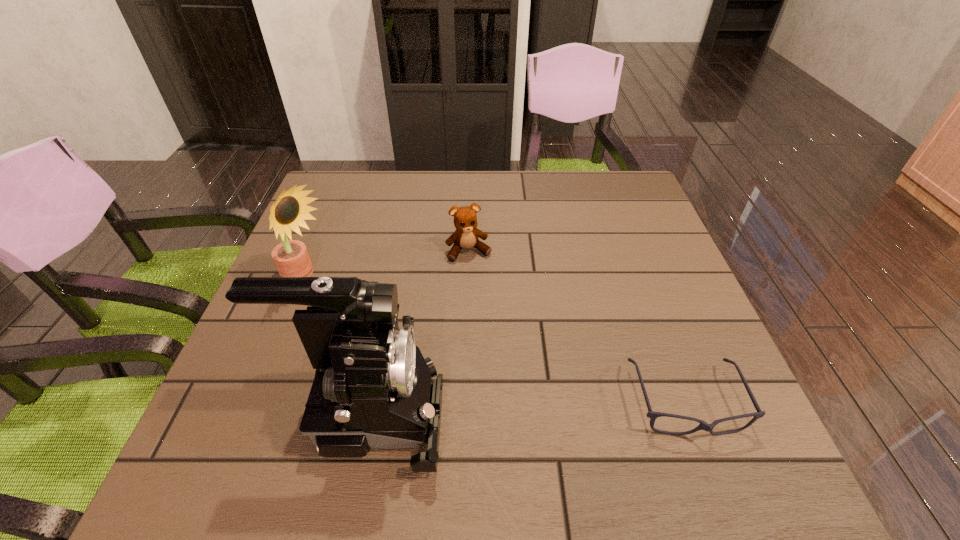
The height and width of the screenshot is (540, 960). Find the location of `camcorder`. camcorder is located at coordinates (372, 388).

At what (x,y) coordinates should I click in order to perform the action: click on the rightmost object. Please return your answer as a coordinate pair (x, y). This screenshot has height=540, width=960. Looking at the image, I should click on (652, 415).

This screenshot has height=540, width=960. Find the location of `the shortest object`. the shortest object is located at coordinates coord(652,415).

At what (x,y) coordinates should I click in order to perform the action: click on sunflower. Please return your answer as a coordinate pair (x, y). Image resolution: width=960 pixels, height=540 pixels. Looking at the image, I should click on (291, 257).

The image size is (960, 540). In order to click on the third shortest object in this screenshot , I will do `click(291, 257)`.

At what (x,y) coordinates should I click in order to perform the action: click on teddy bear. Please return your answer as a coordinate pair (x, y). The height and width of the screenshot is (540, 960). Looking at the image, I should click on (466, 235).

Locate an element on the screen. This screenshot has height=540, width=960. vacant position located 0.210m on the lens mount of the tallest object is located at coordinates (563, 414).

Locate an element on the screen. Image resolution: width=960 pixels, height=540 pixels. free space located 0.160m on the face of the sunflower is located at coordinates (382, 316).

The image size is (960, 540). Find the location of `vacant space located 0.290m on the face of the sunflower`. vacant space located 0.290m on the face of the sunflower is located at coordinates (432, 340).

You are a GUI agent. You are given a task and a screenshot of the screen. Output one action in this format:
    pyautogui.click(x=<x>, y=<y>)
    Task: Click on the vacant space located 0.120m on the face of the sunflower
    This screenshot has width=960, height=540.
    Given the screenshot: What is the action you would take?
    pyautogui.click(x=368, y=309)